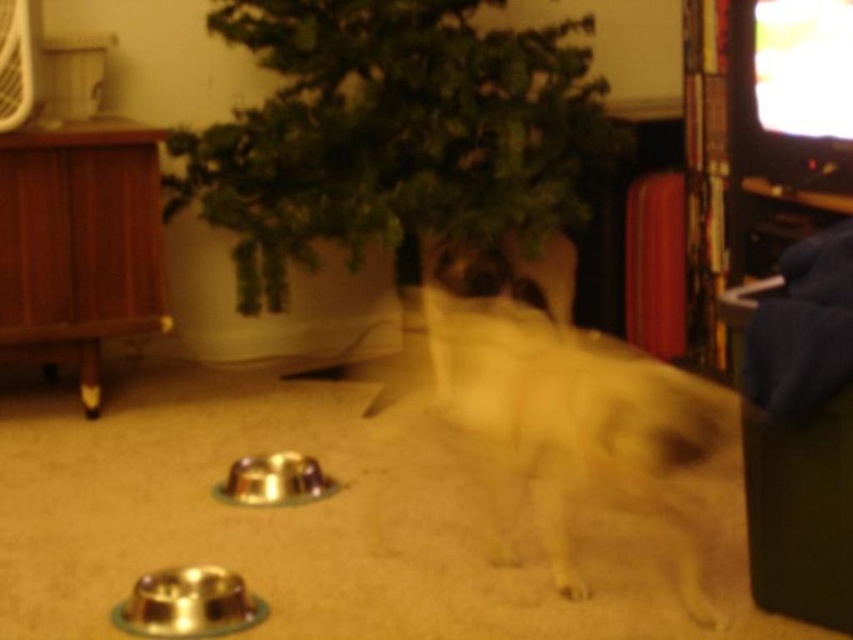
The width and height of the screenshot is (853, 640). Describe the element at coordinates (392, 134) in the screenshot. I see `green leafy plant at center` at that location.

Is green leafy plant at center wider than white fur dog at center?

Indeed, green leafy plant at center has a greater width compared to white fur dog at center.

Identify the location of green leafy plant at center. (392, 134).

Where is `green leafy plant at center`? The height and width of the screenshot is (640, 853). green leafy plant at center is located at coordinates (392, 134).